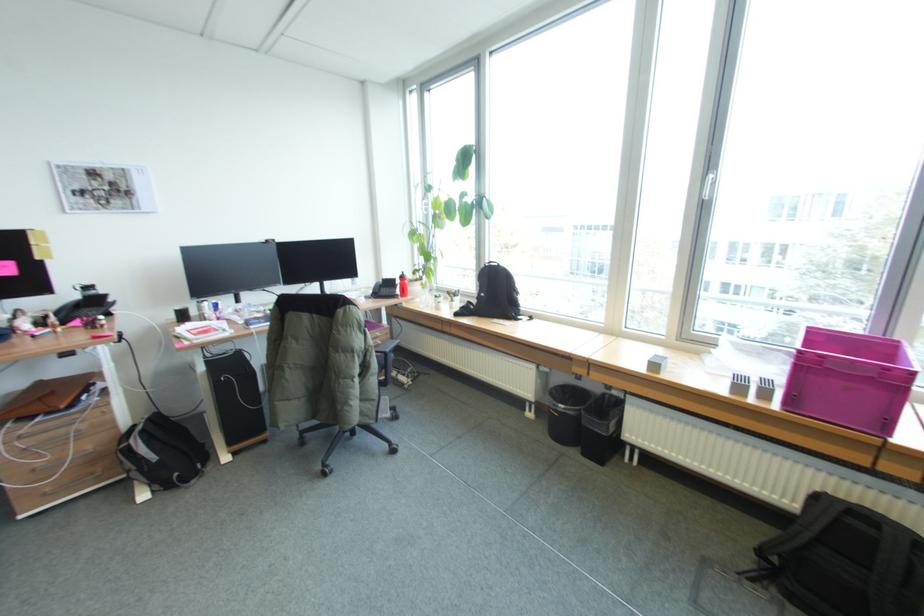
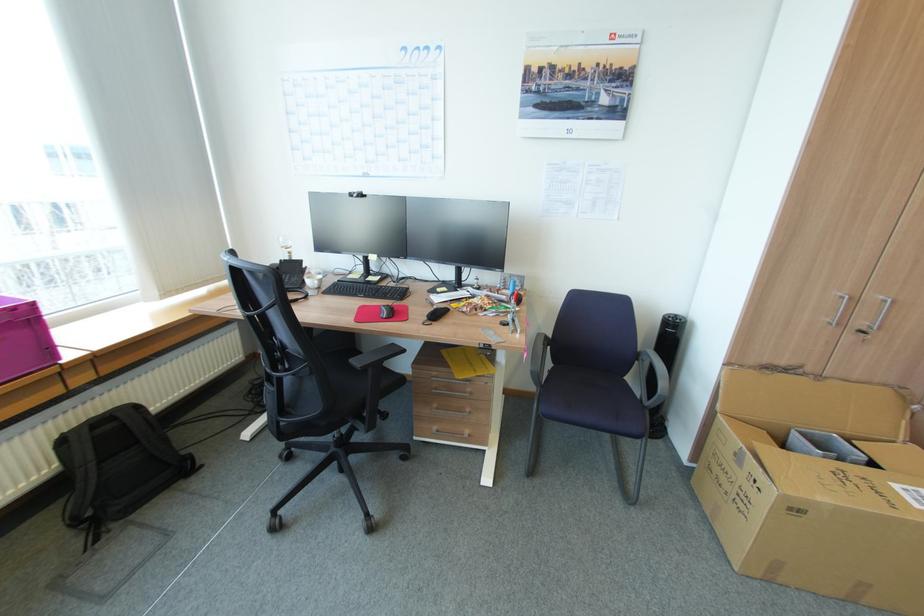
Where in the second image is the point corresponding to pixel 822 496 from the first image?

(68, 440)